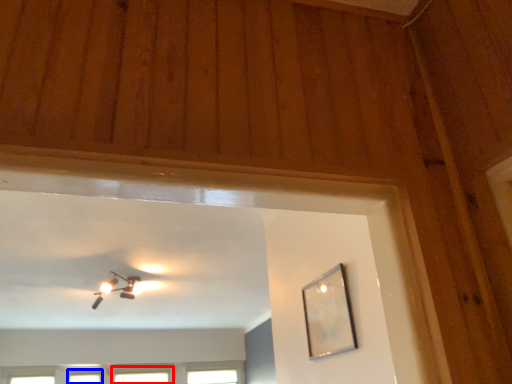
Question: Which object appears closest to the camera in this image, window (highlighted by a red box) or window (highlighted by a blue box)?

Choices:
 (A) window
 (B) window

Answer: (B)